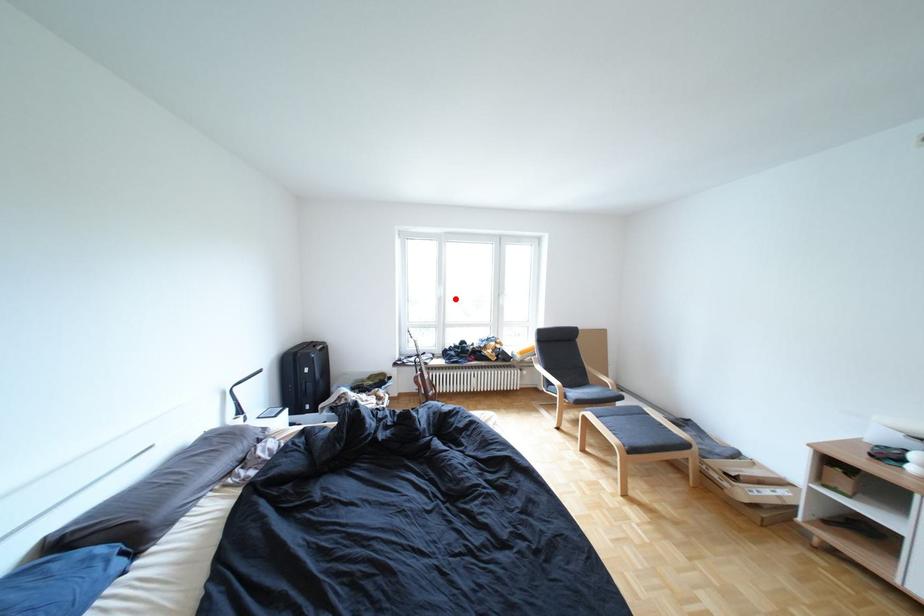
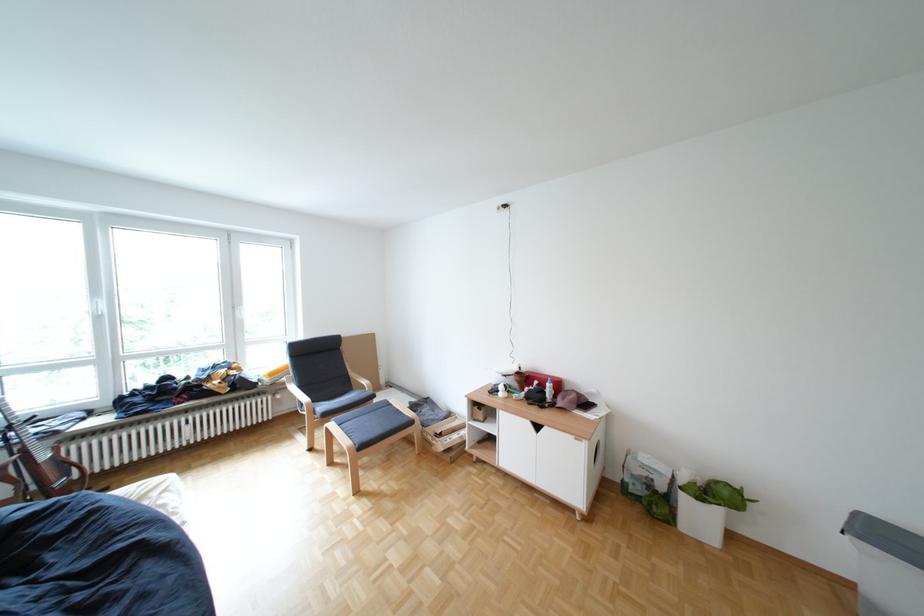
Where in the second image is the point corresponding to the highlighted location from the first image?

(114, 318)